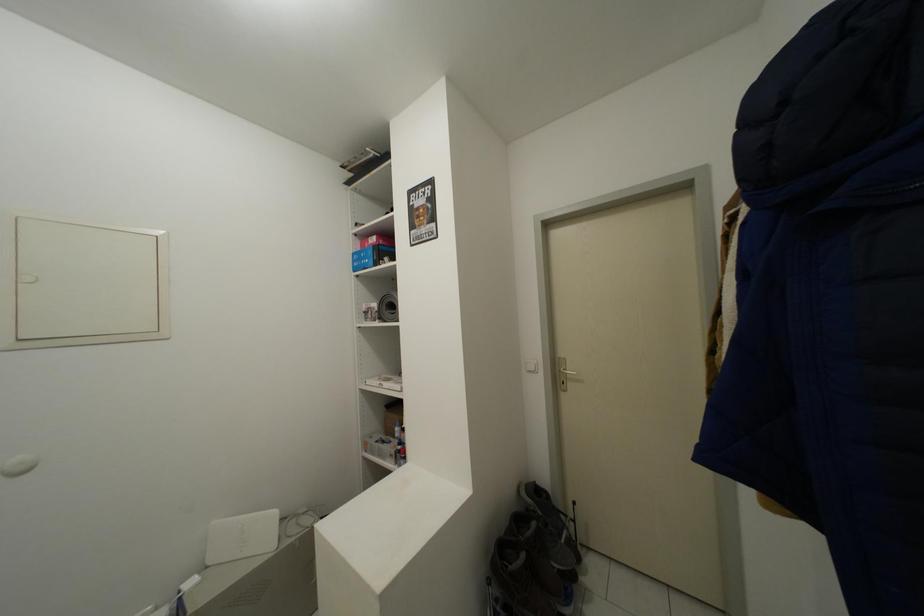
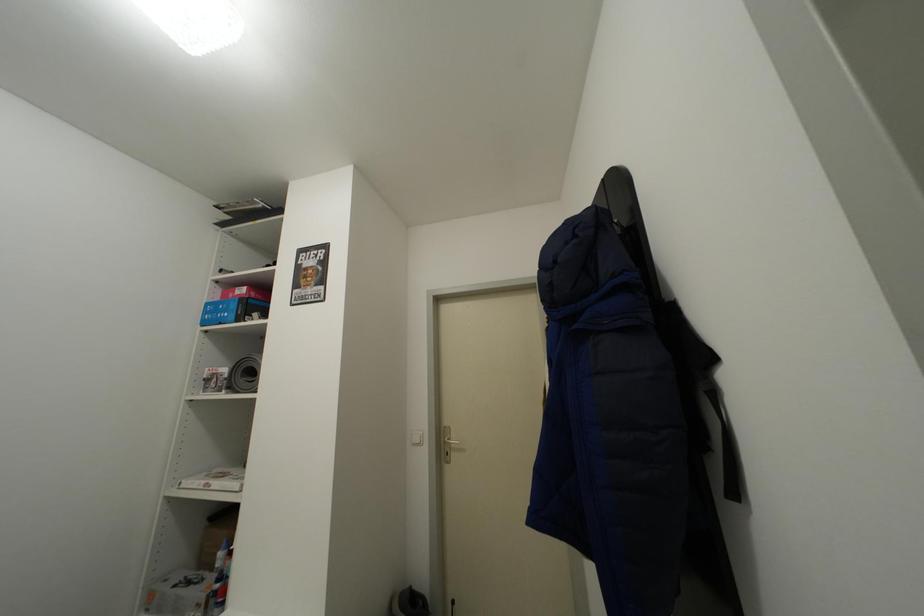
Question: The camera is either moving clockwise (left) or counter-clockwise (right) around the object. The first image is from the beginning of the video and the second image is from the end. Is the camera moving left or right when shooting the video?

Choices:
 (A) Left
 (B) Right

Answer: (A)